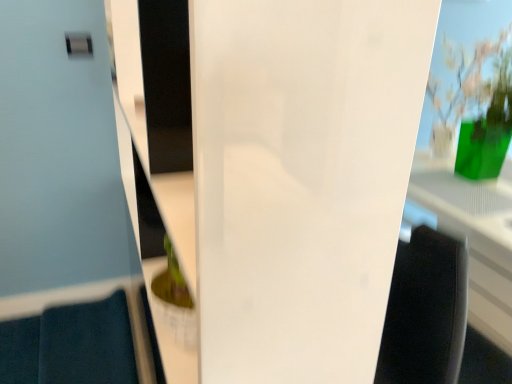
Measure the distance between transparent glass door at center and camera.

transparent glass door at center and camera are 34.72 centimeters apart from each other.

Describe the element at coordinates (301, 179) in the screenshot. I see `transparent glass door at center` at that location.

This screenshot has height=384, width=512. Find the location of `transparent glass door at center`. transparent glass door at center is located at coordinates (301, 179).

Where is `green glass vase at upper right`? This screenshot has width=512, height=384. green glass vase at upper right is located at coordinates click(x=475, y=108).

Consider the image. Measure the distance between point (499, 101) and camera.

The distance of point (499, 101) from camera is 5.67 feet.

The image size is (512, 384). What do you see at coordinates (475, 108) in the screenshot?
I see `green glass vase at upper right` at bounding box center [475, 108].

Where is `transparent glass door at center`? The width and height of the screenshot is (512, 384). transparent glass door at center is located at coordinates (301, 179).

Is green glass vase at upper right at the right side of transparent glass door at center?

Yes.

Considering the positions of objects green glass vase at upper right and transparent glass door at center in the image provided, who is in front, green glass vase at upper right or transparent glass door at center?

transparent glass door at center is in front.

Which is in front, point (457, 97) or point (334, 115)?

The point (334, 115) is in front.

From the image's perspective, which one is positioned lower, green glass vase at upper right or transparent glass door at center?

transparent glass door at center is shown below in the image.

In the scene shown: From a real-world perspective, is green glass vase at upper right positioned over transparent glass door at center based on gravity?

Yes.

In the scene shown: In terms of width, does green glass vase at upper right look wider or thinner when compared to transparent glass door at center?

Considering their sizes, green glass vase at upper right looks broader than transparent glass door at center.

Considering the sizes of objects green glass vase at upper right and transparent glass door at center in the image provided, who is taller, green glass vase at upper right or transparent glass door at center?

With more height is transparent glass door at center.

Is green glass vase at upper right smaller than transparent glass door at center?

Yes, green glass vase at upper right is smaller than transparent glass door at center.

Is transparent glass door at center a part of green glass vase at upper right?

Definitely not — transparent glass door at center is not inside green glass vase at upper right.

Is green glass vase at upper right with transparent glass door at center?

No, green glass vase at upper right is not touching transparent glass door at center.

Does green glass vase at upper right turn towards transparent glass door at center?

No, green glass vase at upper right is not oriented towards transparent glass door at center.

This screenshot has width=512, height=384. Find the location of `floral arrangement that appears on the right of transparent glass door at center`. floral arrangement that appears on the right of transparent glass door at center is located at coordinates (475, 108).

From the picture: Which is more to the right, transparent glass door at center or green glass vase at upper right?

green glass vase at upper right.

Considering the positions of objects transparent glass door at center and green glass vase at upper right in the image provided, who is in front, transparent glass door at center or green glass vase at upper right?

transparent glass door at center.

Which point is more forward, (398, 137) or (473, 170)?

The point (398, 137) is closer to the camera.

From the image's perspective, is transparent glass door at center on top of green glass vase at upper right?

No, from the image's perspective, transparent glass door at center is not over green glass vase at upper right.

From a real-world perspective, who is located lower, transparent glass door at center or green glass vase at upper right?

transparent glass door at center is physically lower.

Consider the image. Is transparent glass door at center wider or thinner than green glass vase at upper right?

transparent glass door at center is thinner than green glass vase at upper right.

Between transparent glass door at center and green glass vase at upper right, which one has less height?

green glass vase at upper right is shorter.

Is transparent glass door at center smaller than green glass vase at upper right?

No.

Is transparent glass door at center inside the boundaries of green glass vase at upper right, or outside?

transparent glass door at center cannot be found inside green glass vase at upper right.

Is transparent glass door at center in contact with green glass vase at upper right?

transparent glass door at center and green glass vase at upper right are not in contact.

Could you tell me if transparent glass door at center is turned towards green glass vase at upper right?

Yes, transparent glass door at center is oriented towards green glass vase at upper right.

Measure the distance from transparent glass door at center to green glass vase at upper right.

A distance of 1.63 meters exists between transparent glass door at center and green glass vase at upper right.

Identify the location of floral arrangement that appears above the transparent glass door at center (from a real-world perspective). The height and width of the screenshot is (384, 512). (475, 108).

This screenshot has width=512, height=384. Identify the location of floral arrangement above the transparent glass door at center (from a real-world perspective). (475, 108).

What are the coordinates of `glass door directly beneath the green glass vase at upper right (from a real-world perspective)` in the screenshot? It's located at (301, 179).